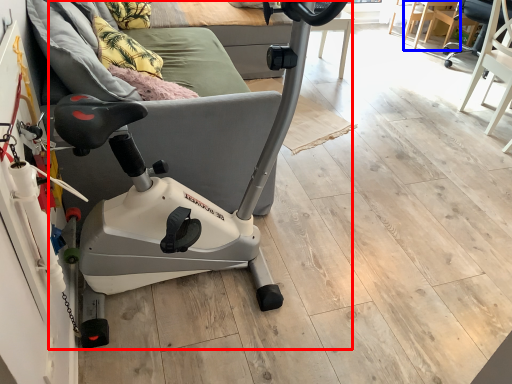
Question: Which object appears closest to the camera in this image, stationary bicycle (highlighted by a red box) or table (highlighted by a blue box)?

Choices:
 (A) stationary bicycle
 (B) table

Answer: (A)